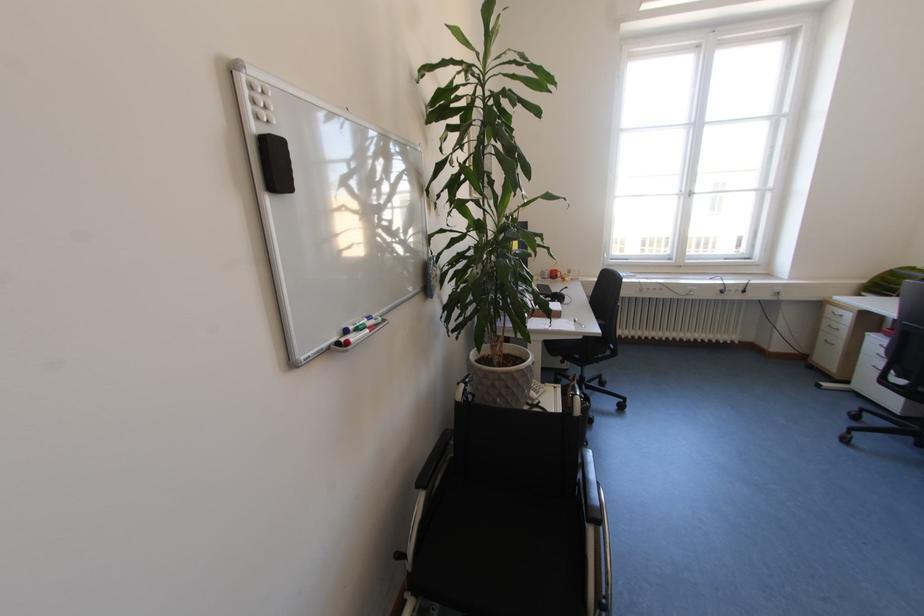
Describe the element at coordinates (359, 337) in the screenshot. I see `the red whiteboard marker` at that location.